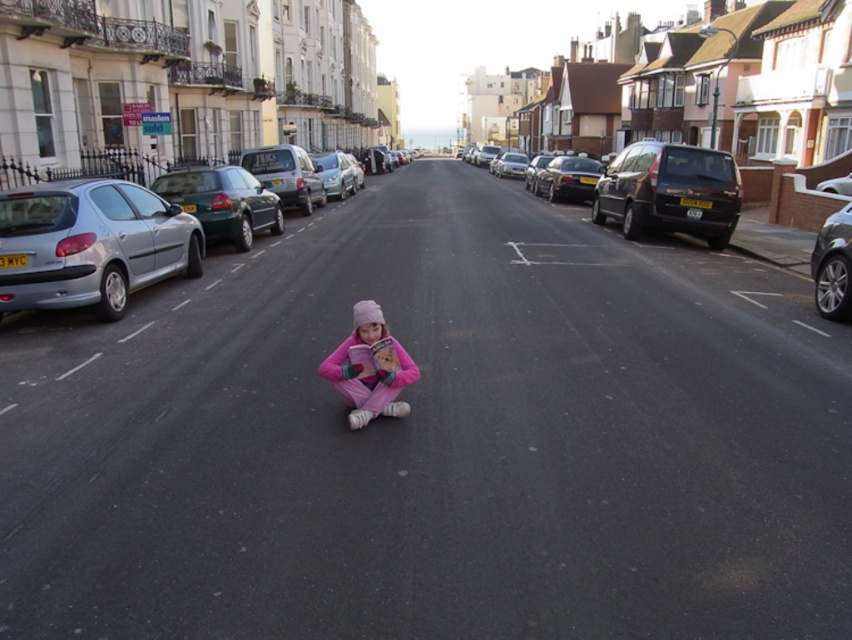
Question: Does green matte car at left have a lesser width compared to shiny black car at center right?

Choices:
 (A) no
 (B) yes

Answer: (A)

Question: Which object is the farthest from the matte silver van at center-left?

Choices:
 (A) green matte car at left
 (B) metallic silver car at center
 (C) pink fleece pants at center
 (D) silver metallic sedan at center

Answer: (D)

Question: Which point is farther from the camera taking this photo?

Choices:
 (A) (292, 145)
 (B) (528, 173)
 (C) (839, 314)
 (D) (182, 180)

Answer: (A)

Question: Considering the relative positions of black matte van at right and shiny black car at center right in the image provided, where is black matte van at right located with respect to shiny black car at center right?

Choices:
 (A) left
 (B) right

Answer: (A)

Question: Is the position of silver metallic sedan at center more distant than that of shiny black car at center right?

Choices:
 (A) yes
 (B) no

Answer: (A)

Question: Which of the following is the closest to the observer?

Choices:
 (A) (168, 257)
 (B) (229, 204)

Answer: (A)